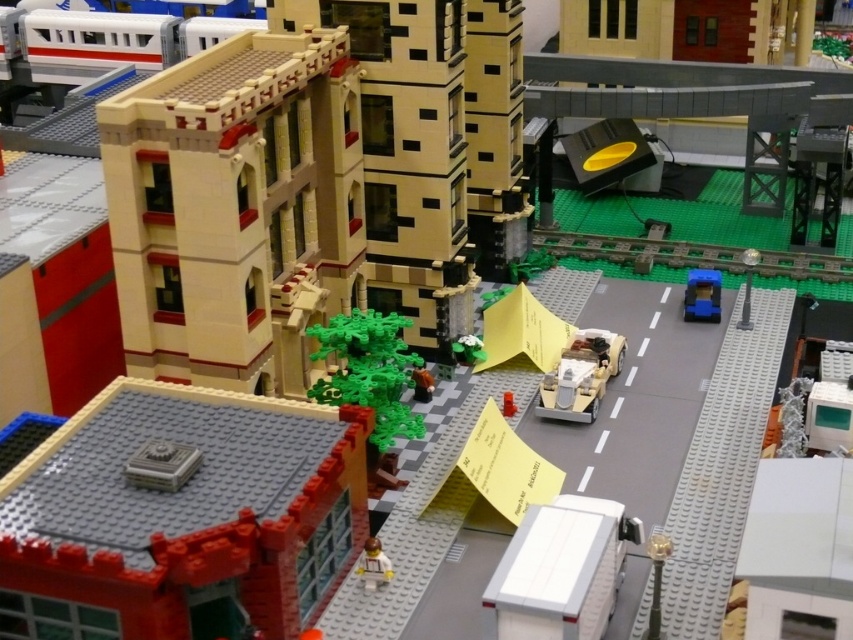
You are designing a Lego city layout and need to place the smooth red brick building at lower left and the gold metallic car at center. Given their sizes, which object should you prioritize placing first to ensure they both fit in the available space?

The smooth red brick building at lower left occupies less space than the gold metallic car at center, so you should prioritize placing the gold metallic car at center first to ensure there is enough space for both objects.

You are a Lego figure standing on the sidewalk. You need to move from the smooth red brick building at lower left to the blue plastic car at right. Which direction should you walk to reach the car?

Since the smooth red brick building at lower left is larger than the blue plastic car at right, you should walk towards the smaller object to reach the blue plastic car at right.